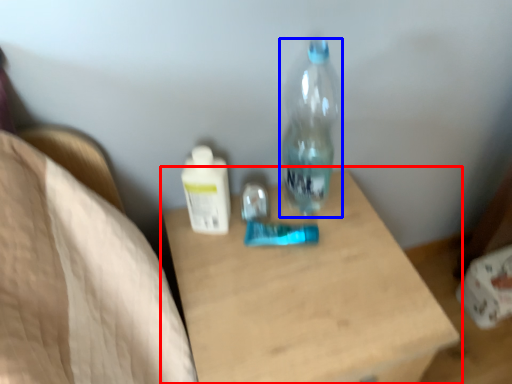
Question: Which point is closer to the camera, table (highlighted by a red box) or bottle (highlighted by a blue box)?

Choices:
 (A) table
 (B) bottle

Answer: (A)